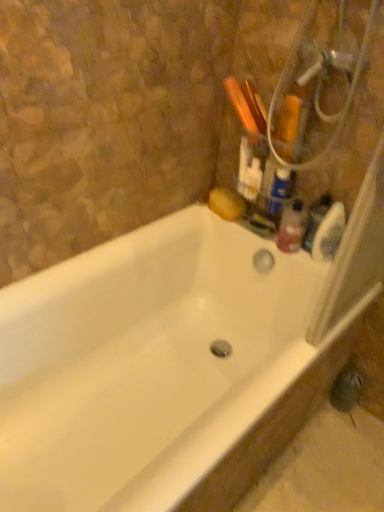
Question: Considering the relative sizes of white glossy bathtub at upper right and translucent plastic soap dispenser at upper right in the image provided, is white glossy bathtub at upper right wider than translucent plastic soap dispenser at upper right?

Choices:
 (A) yes
 (B) no

Answer: (A)

Question: Is white glossy bathtub at upper right oriented towards translucent plastic soap dispenser at upper right?

Choices:
 (A) no
 (B) yes

Answer: (A)

Question: From the image's perspective, does white glossy bathtub at upper right appear higher than translucent plastic soap dispenser at upper right?

Choices:
 (A) yes
 (B) no

Answer: (B)

Question: Can you confirm if white glossy bathtub at upper right is thinner than translucent plastic soap dispenser at upper right?

Choices:
 (A) no
 (B) yes

Answer: (A)

Question: Does white glossy bathtub at upper right touch translucent plastic soap dispenser at upper right?

Choices:
 (A) no
 (B) yes

Answer: (A)

Question: Is white glossy bathtub at upper right shorter than translucent plastic soap dispenser at upper right?

Choices:
 (A) yes
 (B) no

Answer: (B)

Question: Is translucent plastic bottle at upper right, which ranks as the 1th cleaning product in top-to-bottom order, directly adjacent to translucent plastic soap dispenser at upper right?

Choices:
 (A) no
 (B) yes

Answer: (A)

Question: Is translucent plastic bottle at upper right, which ranks as the 1th cleaning product in top-to-bottom order, in front of translucent plastic soap dispenser at upper right?

Choices:
 (A) no
 (B) yes

Answer: (B)

Question: Can you confirm if translucent plastic bottle at upper right, marked as the second cleaning product in a bottom-to-top arrangement, is positioned to the left of translucent plastic soap dispenser at upper right?

Choices:
 (A) no
 (B) yes

Answer: (B)

Question: Is translucent plastic soap dispenser at upper right a part of translucent plastic bottle at upper right, marked as the second cleaning product in a bottom-to-top arrangement?

Choices:
 (A) yes
 (B) no

Answer: (B)

Question: From the image's perspective, is translucent plastic bottle at upper right, which ranks as the 1th cleaning product in top-to-bottom order, on translucent plastic soap dispenser at upper right?

Choices:
 (A) yes
 (B) no

Answer: (A)

Question: Is translucent plastic bottle at upper right, which ranks as the 1th cleaning product in top-to-bottom order, positioned with its back to translucent plastic soap dispenser at upper right?

Choices:
 (A) no
 (B) yes

Answer: (A)

Question: Would you say translucent plastic soap dispenser at upper right is a long distance from translucent plastic bottle at upper right, which ranks as the 1th cleaning product in top-to-bottom order?

Choices:
 (A) yes
 (B) no

Answer: (B)